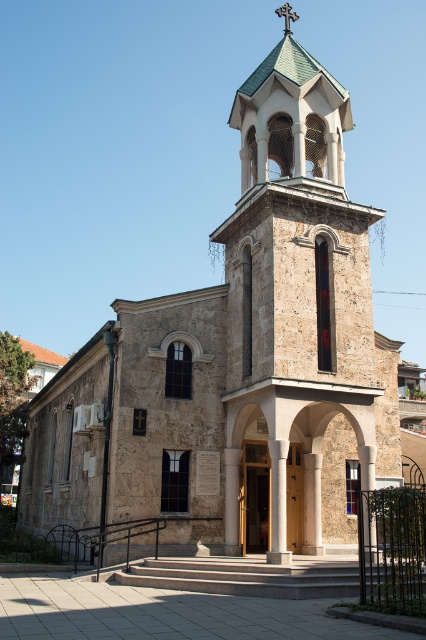
Does point (250, 193) come closer to viewer compared to point (288, 113)?

That is True.

Identify the location of stone steeple at center. This screenshot has height=640, width=426. (299, 321).